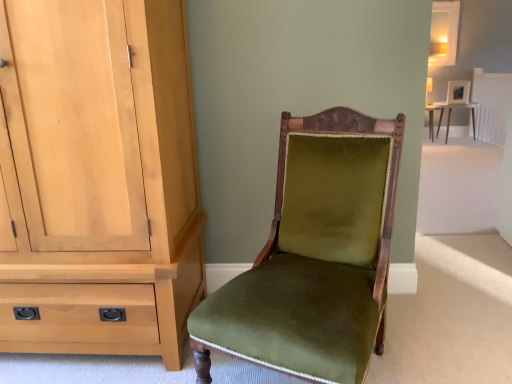
What do you see at coordinates (431, 118) in the screenshot?
I see `matte white table at upper right` at bounding box center [431, 118].

In order to face velvet-green chair at center, should I rotate leftwards or rightwards?

Rotate your view right by about 6.893°.

This screenshot has width=512, height=384. What do you see at coordinates (314, 256) in the screenshot?
I see `velvet-green chair at center` at bounding box center [314, 256].

Locate an element on the screen. matte white table at upper right is located at coordinates (431, 118).

Is there a large distance between light wood cabinet at left and matte white table at upper right?

That's right, there is a large distance between light wood cabinet at left and matte white table at upper right.

Who is more distant, light wood cabinet at left or matte white table at upper right?

matte white table at upper right.

The height and width of the screenshot is (384, 512). I want to click on cabinetry lying below the matte white table at upper right (from the image's perspective), so click(x=98, y=178).

Between light wood cabinet at left and matte white table at upper right, which one has more height?

With more height is light wood cabinet at left.

Where is `cabinetry behind the velvet-green chair at center`? The image size is (512, 384). cabinetry behind the velvet-green chair at center is located at coordinates (98, 178).

Is light wood cabinet at left completely or partially outside of velvet-green chair at center?

Yes.

Does light wood cabinet at left have a greater height compared to velvet-green chair at center?

Correct, light wood cabinet at left is much taller as velvet-green chair at center.

Does point (95, 195) appear closer or farther from the camera than point (288, 253)?

Point (95, 195) appears to be closer to the viewer than point (288, 253).

Who is smaller, velvet-green chair at center or matte white table at upper right?

A: matte white table at upper right.

Who is taller, velvet-green chair at center or matte white table at upper right?

With more height is velvet-green chair at center.

Is velvet-green chair at center oriented towards matte white table at upper right?

No, velvet-green chair at center is not aimed at matte white table at upper right.

Is velvet-green chair at center to the left of matte white table at upper right from the viewer's perspective?

Indeed, velvet-green chair at center is positioned on the left side of matte white table at upper right.

Is matte white table at upper right positioned behind light wood cabinet at left?

Yes, the depth of matte white table at upper right is greater than that of light wood cabinet at left.

How different are the orientations of matte white table at upper right and light wood cabinet at left in degrees?

matte white table at upper right and light wood cabinet at left are facing 0.435 degrees away from each other.

Which is more to the left, matte white table at upper right or light wood cabinet at left?

Result: light wood cabinet at left.

Is point (433, 110) positioned in front of point (288, 369)?

No.

From a real-world perspective, is matte white table at upper right under velvet-green chair at center?

Indeed, from a real-world perspective, matte white table at upper right is positioned beneath velvet-green chair at center.

Is matte white table at upper right oriented towards velvet-green chair at center?

No, matte white table at upper right is not turned towards velvet-green chair at center.

From the image's perspective, is velvet-green chair at center beneath light wood cabinet at left?

Yes, from the image's perspective, velvet-green chair at center is beneath light wood cabinet at left.

From a real-world perspective, is velvet-green chair at center physically above light wood cabinet at left?

Incorrect, from a real-world perspective, velvet-green chair at center is lower than light wood cabinet at left.

Is velvet-green chair at center inside or outside of light wood cabinet at left?

velvet-green chair at center exists outside the volume of light wood cabinet at left.

Is velvet-green chair at center wider or thinner than light wood cabinet at left?

Considering their sizes, velvet-green chair at center looks broader than light wood cabinet at left.

Image resolution: width=512 pixels, height=384 pixels. I want to click on table that appears behind the light wood cabinet at left, so [x=431, y=118].

The height and width of the screenshot is (384, 512). In the image, there is a light wood cabinet at left. Find the location of `chair below it (from a real-world perspective)`. chair below it (from a real-world perspective) is located at coordinates (314, 256).

Considering their positions, is velvet-green chair at center positioned further to matte white table at upper right than light wood cabinet at left?

light wood cabinet at left is further to matte white table at upper right.

Which object lies further to the anchor point light wood cabinet at left, velvet-green chair at center or matte white table at upper right?

matte white table at upper right is positioned further to the anchor light wood cabinet at left.

Considering their positions, is matte white table at upper right positioned further to light wood cabinet at left than velvet-green chair at center?

matte white table at upper right lies further to light wood cabinet at left than the other object.

Estimate the real-world distances between objects in this image. Which object is further from velvet-green chair at center, matte white table at upper right or light wood cabinet at left?

Among the two, matte white table at upper right is located further to velvet-green chair at center.

When comparing their distances from matte white table at upper right, does light wood cabinet at left or velvet-green chair at center seem closer?

Among the two, velvet-green chair at center is located nearer to matte white table at upper right.

Which object lies further to the anchor point velvet-green chair at center, light wood cabinet at left or matte white table at upper right?

matte white table at upper right is positioned further to the anchor velvet-green chair at center.

Find the location of a particular element. This screenshot has width=512, height=384. cabinetry between velvet-green chair at center and matte white table at upper right from front to back is located at coordinates (98, 178).